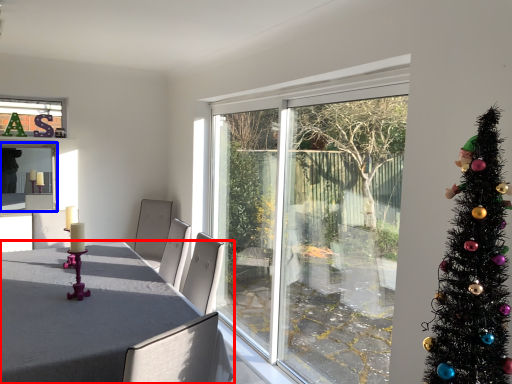
Question: Which of the following is the farthest to the observer, table (highlighted by a red box) or window screen (highlighted by a blue box)?

Choices:
 (A) table
 (B) window screen

Answer: (B)